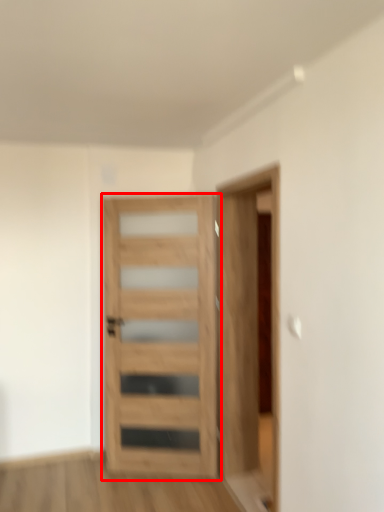
Question: From the image, what is the correct spatial relationship of door (annotated by the red box) in relation to garage door?

Choices:
 (A) right
 (B) left

Answer: (B)